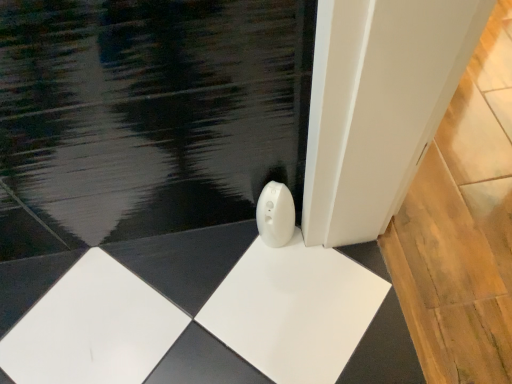
In order to face white matte toilet at lower center, should I rotate leftwards or rightwards?

Turn right approximately 2.376 degrees to face it.

This screenshot has width=512, height=384. What do you see at coordinates (275, 215) in the screenshot? I see `white matte toilet at lower center` at bounding box center [275, 215].

Where is `white matte toilet at lower center`? white matte toilet at lower center is located at coordinates (275, 215).

Identify the location of white matte toilet at lower center. (275, 215).